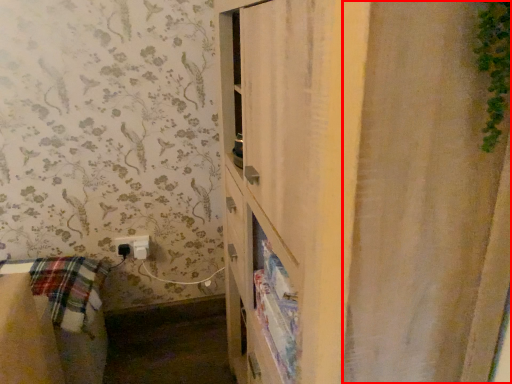
Question: In this image, where is shower curtain (annotated by the red box) located relative to electric outlet?

Choices:
 (A) right
 (B) left

Answer: (A)